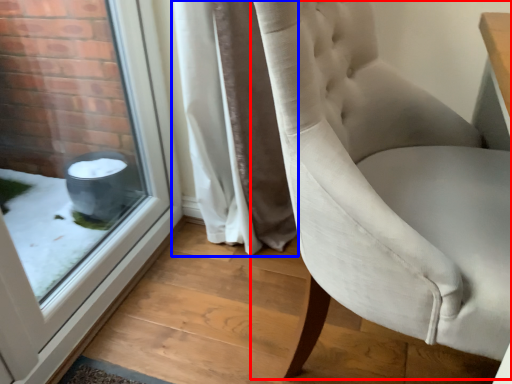
Question: Among these objects, which one is nearest to the camera, chair (highlighted by a red box) or curtain (highlighted by a blue box)?

Choices:
 (A) chair
 (B) curtain

Answer: (A)